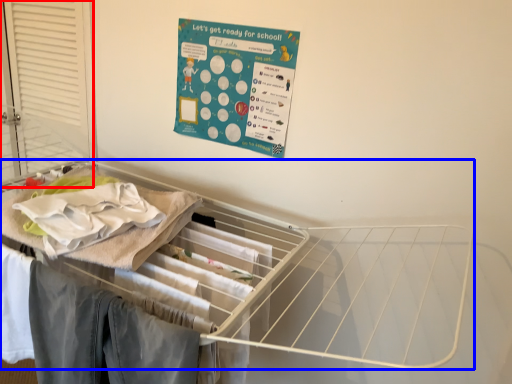
Question: Which object appears closest to the camera in this image, screen door (highlighted by a red box) or furniture (highlighted by a blue box)?

Choices:
 (A) screen door
 (B) furniture

Answer: (B)